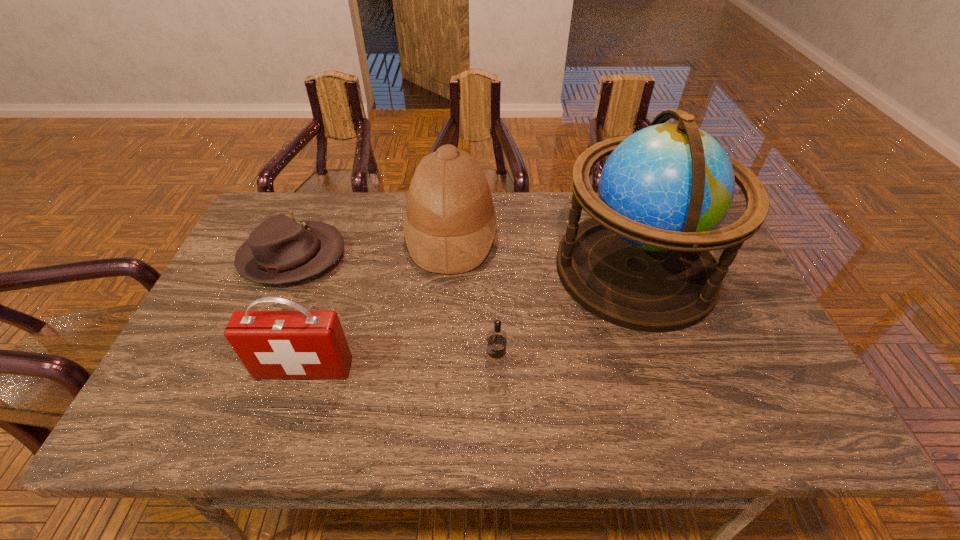
Find the location of a particular element. globe is located at coordinates (642, 261).

Locate an element on the screen. This screenshot has height=540, width=960. the tallest object is located at coordinates (642, 261).

This screenshot has height=540, width=960. Find the location of `the right hat`. the right hat is located at coordinates (450, 222).

The image size is (960, 540). I want to click on the third shortest object, so 272,344.

I want to click on the fourth tallest object, so click(495, 363).

This screenshot has width=960, height=540. In order to click on the left hat in this screenshot , I will do `click(280, 250)`.

Where is `the shorter hat`? The width and height of the screenshot is (960, 540). the shorter hat is located at coordinates (280, 250).

Where is `vacant space located 0.140m on the left of the tallest object`? vacant space located 0.140m on the left of the tallest object is located at coordinates (507, 269).

You are a GUI agent. You are given a task and a screenshot of the screen. Output one action in this format:
    pyautogui.click(x=<x>, y=<y>)
    Task: Click on the vacant space located on the front-facing side of the right hat
    Image resolution: width=960 pixels, height=540 pixels.
    Given the screenshot: What is the action you would take?
    pyautogui.click(x=549, y=234)

Identify the location of free space located 0.100m on the front face of the first-aid kit. Image resolution: width=960 pixels, height=540 pixels. (287, 423).